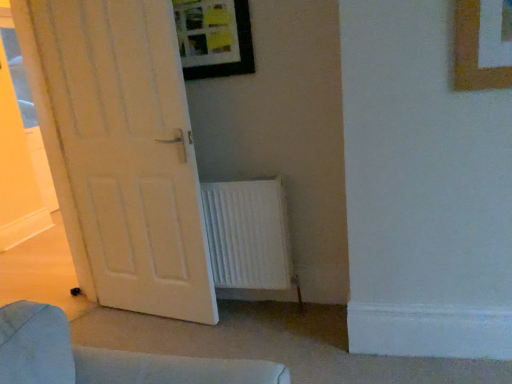
Question: From the image's perspective, is white textured radiator at lower center above or below white matte door at left?

Choices:
 (A) below
 (B) above

Answer: (A)

Question: Based on their positions, is white textured radiator at lower center located to the left or right of white matte door at left?

Choices:
 (A) left
 (B) right

Answer: (B)

Question: Which of these objects is positioned farthest from the white matte door at left?

Choices:
 (A) white textured radiator at lower center
 (B) wooden-framed picture at upper center

Answer: (B)

Question: Which object is the closest to the wooden-framed picture at upper center?

Choices:
 (A) white textured radiator at lower center
 (B) white matte door at left

Answer: (B)